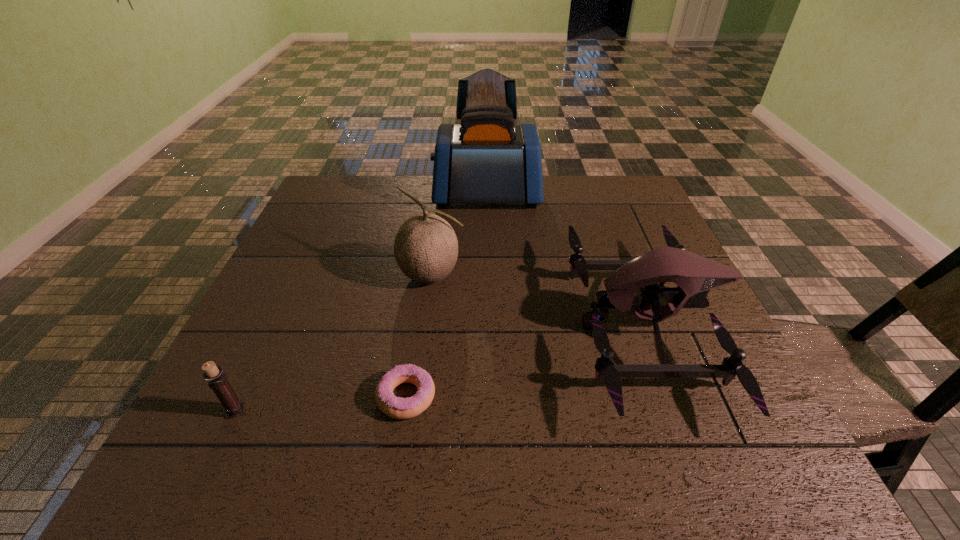
Locate an element on the screen. This screenshot has width=960, height=540. object that is at the near right corner is located at coordinates (695, 275).

Image resolution: width=960 pixels, height=540 pixels. In order to click on free spot at the far edge of the desktop in this screenshot , I will do `click(514, 207)`.

Locate an element on the screen. The height and width of the screenshot is (540, 960). vacant space at the near edge of the desktop is located at coordinates (539, 481).

Image resolution: width=960 pixels, height=540 pixels. I want to click on vacant position at the left edge of the desktop, so click(249, 335).

The image size is (960, 540). In the image, there is a desktop. Identify the location of vacant space at the right edge. (607, 232).

The width and height of the screenshot is (960, 540). Find the location of `empty location between the candle holder and the shortest object`. empty location between the candle holder and the shortest object is located at coordinates (321, 403).

I want to click on vacant point located between the cantaloup and the farthest object, so click(459, 236).

The height and width of the screenshot is (540, 960). Find the location of `free spot between the toaster and the cantaloup`. free spot between the toaster and the cantaloup is located at coordinates (459, 236).

This screenshot has height=540, width=960. I want to click on vacant area that lies between the cantaloup and the tallest object, so click(459, 236).

You are a GUI agent. You are given a task and a screenshot of the screen. Output one action in this format:
    pyautogui.click(x=<x>, y=<y>)
    Task: Click on the vacant point located between the drone and the cantaloup
    
    Given the screenshot: What is the action you would take?
    pyautogui.click(x=539, y=301)